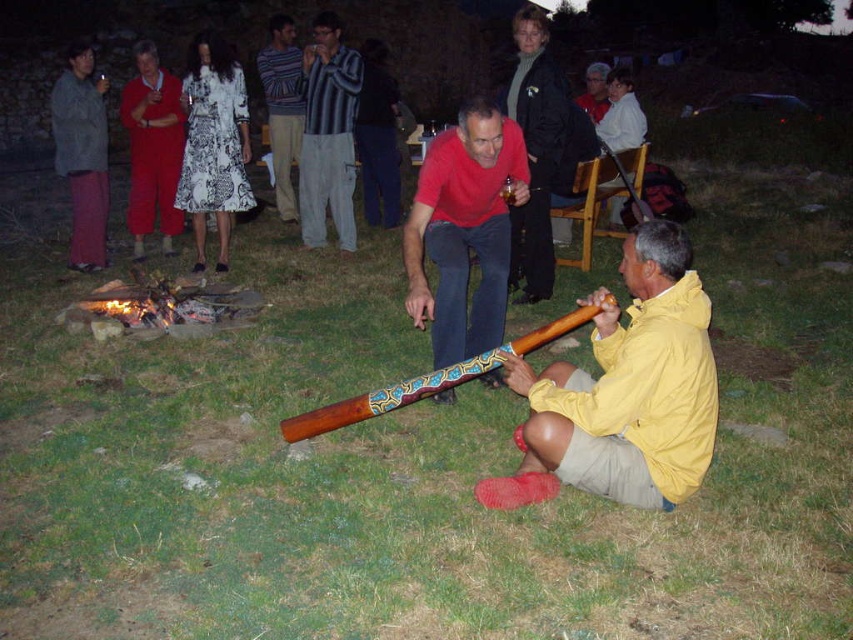
Question: Which point is closer to the camera?

Choices:
 (A) matte black jacket at upper center
 (B) wooden painted didgeridoo at center

Answer: (B)

Question: Which object appears farthest from the camera in this image?

Choices:
 (A) matte black jacket at upper center
 (B) wooden painted didgeridoo at center
 (C) brushed metal didgeridoo at upper left

Answer: (C)

Question: Is yellow matte jacket at lower right closer to camera compared to matte black jacket at upper center?

Choices:
 (A) no
 (B) yes

Answer: (B)

Question: Can you confirm if wooden painted didgeridoo at center is positioned to the left of striped cotton shirt at center?

Choices:
 (A) no
 (B) yes

Answer: (A)

Question: Among these objects, which one is nearest to the camera?

Choices:
 (A) striped cotton shirt at upper center
 (B) matte black jacket at upper center
 (C) brushed metal didgeridoo at upper left

Answer: (B)

Question: Does matte black jacket at upper center appear on the right side of striped cotton shirt at center?

Choices:
 (A) no
 (B) yes

Answer: (B)